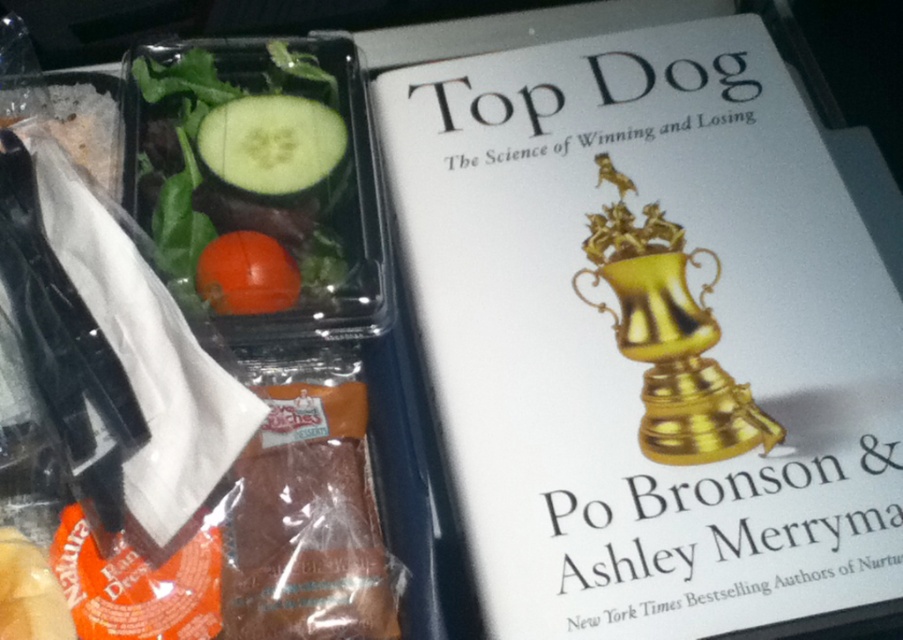
You are a nutritionist analyzing the placement of the cucumbers on the meal tray. How far apart are the green matte cucumber at upper left and the green matte cucumber at center?

The green matte cucumber at upper left and the green matte cucumber at center are 1.35 inches apart from each other.